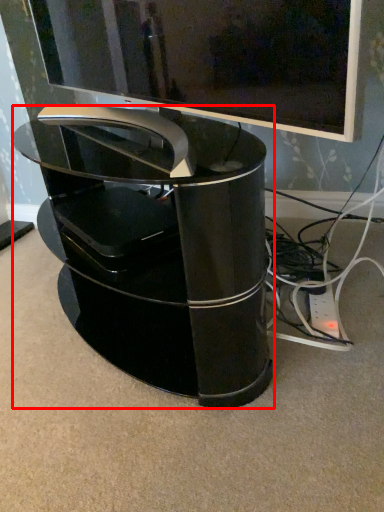
Question: From the image, what is the correct spatial relationship of furniture (annotated by the red box) in relation to television?

Choices:
 (A) left
 (B) right

Answer: (B)